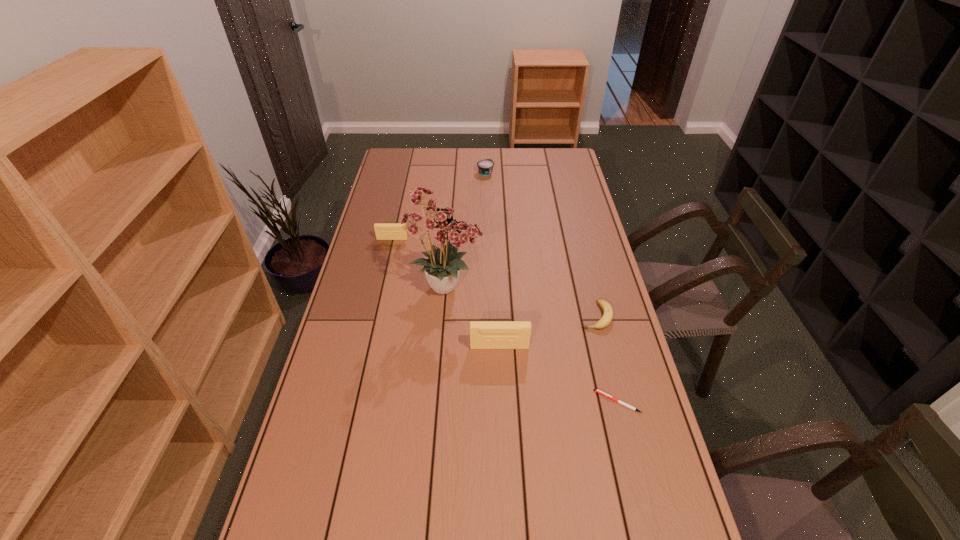
The width and height of the screenshot is (960, 540). I want to click on free region located 0.390m at the front of the fifth nearest object with spools, so click(374, 316).

At what (x,y) coordinates should I click in order to perform the action: click on vacant region located 0.210m at the front of the nearer videotape with spools. Please return your answer as a coordinate pair (x, y). Looking at the image, I should click on (502, 414).

The width and height of the screenshot is (960, 540). Identify the location of blank space located on the left of the third shortest object. (412, 172).

I want to click on free space located 0.170m on the front-facing side of the flower arrangement, so click(x=537, y=286).

Image resolution: width=960 pixels, height=540 pixels. I want to click on vacant region located 0.100m on the left of the second shortest object, so click(549, 316).

I want to click on free spot located 0.070m on the clicker of the nearest object, so click(570, 401).

The width and height of the screenshot is (960, 540). In order to click on free space located on the clicker of the nearest object in this screenshot , I will do `click(494, 401)`.

Where is `vacant space situated 0.380m on the clicker of the nearest object`? The width and height of the screenshot is (960, 540). vacant space situated 0.380m on the clicker of the nearest object is located at coordinates (458, 401).

I want to click on object positioned at the far edge, so click(485, 167).

You are a GUI agent. You are given a task and a screenshot of the screen. Output one action in this format:
    pyautogui.click(x=<x>, y=<y>)
    Task: Click on the object at the left edge
    Image resolution: width=960 pixels, height=540 pixels.
    Given the screenshot: What is the action you would take?
    pyautogui.click(x=384, y=231)